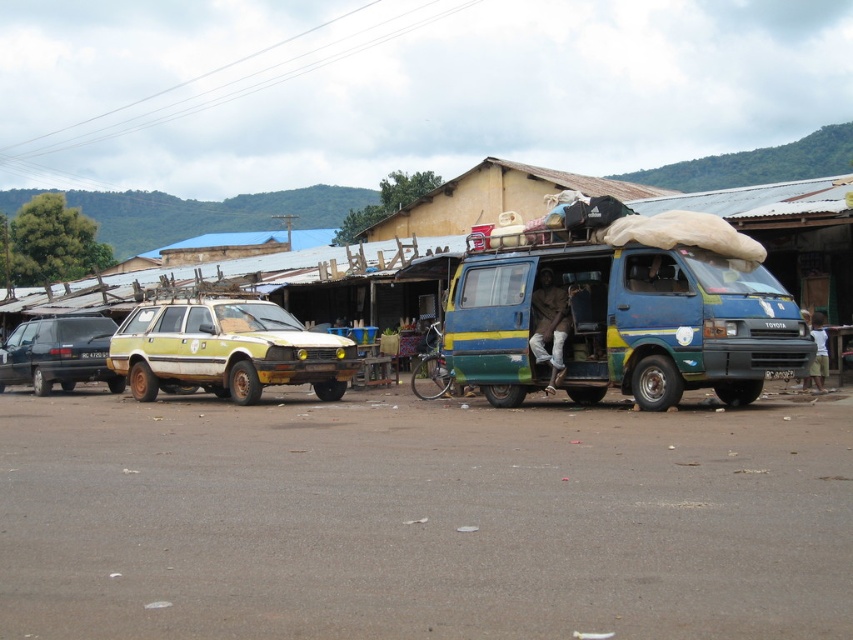
Question: Which point appears farthest from the camera in this image?

Choices:
 (A) (209, 330)
 (B) (18, 355)
 (C) (743, 264)

Answer: (B)

Question: Can you confirm if blue painted metal van at center is bigger than matte black minivan at left?

Choices:
 (A) no
 (B) yes

Answer: (B)

Question: Does blue painted metal van at center have a larger size compared to dirty yellow car at left?

Choices:
 (A) yes
 (B) no

Answer: (A)

Question: Is dirty yellow car at left above matte black minivan at left?

Choices:
 (A) yes
 (B) no

Answer: (A)

Question: Estimate the real-world distances between objects in this image. Which object is farther from the matte black minivan at left?

Choices:
 (A) dirty yellow car at left
 (B) blue painted metal van at center

Answer: (B)

Question: Which of the following is the farthest from the observer?

Choices:
 (A) (90, 365)
 (B) (654, 371)
 (C) (132, 340)

Answer: (A)